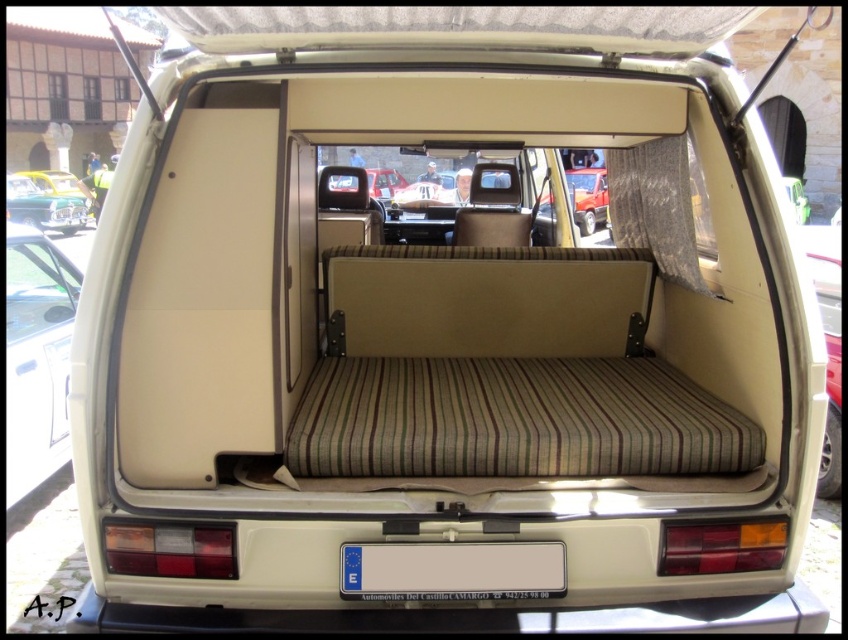
Describe the element at coordinates (37, 356) in the screenshot. Image resolution: width=848 pixels, height=640 pixels. I see `white matte car at left` at that location.

Consider the image. Does white matte car at left have a greater height compared to shiny green car at upper left?

No, white matte car at left is not taller than shiny green car at upper left.

Locate an element on the screen. The image size is (848, 640). white matte car at left is located at coordinates (37, 356).

Can you confirm if white matte car at left is shorter than white plastic license plate at center?

Incorrect, white matte car at left's height does not fall short of white plastic license plate at center's.

Does white matte car at left appear under white plastic license plate at center?

No, white matte car at left is not below white plastic license plate at center.

Locate an element on the screen. white matte car at left is located at coordinates (37, 356).

In the scene shown: Between white plastic license plate at center and shiny green car at upper left, which one is positioned higher?

Positioned higher is shiny green car at upper left.

Consider the image. Who is more distant from viewer, (470, 561) or (8, 188)?

The point (8, 188) is more distant.

What are the coordinates of `white plastic license plate at center` in the screenshot? It's located at (450, 570).